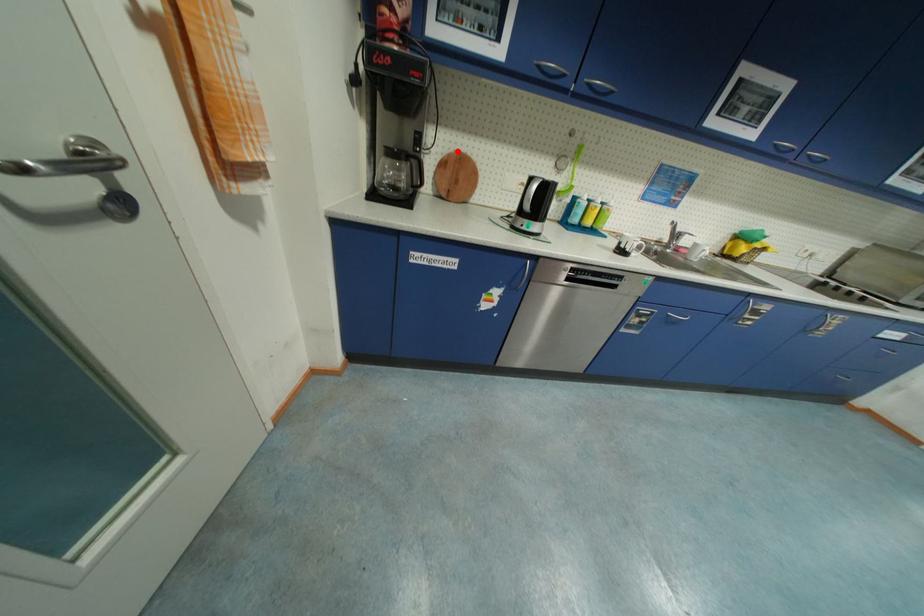
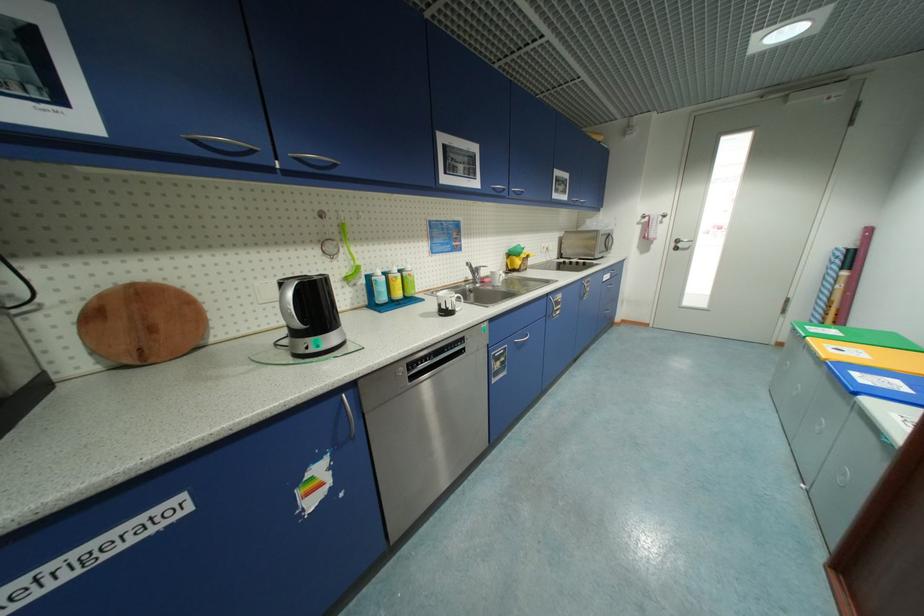
Question: A red point is marked in image1. In image2, is the corresponding 3D point closer to the camera or farther? Reply with the corresponding letter.

Choices:
 (A) The corresponding 3D point is closer.
 (B) The corresponding 3D point is farther.

Answer: (B)